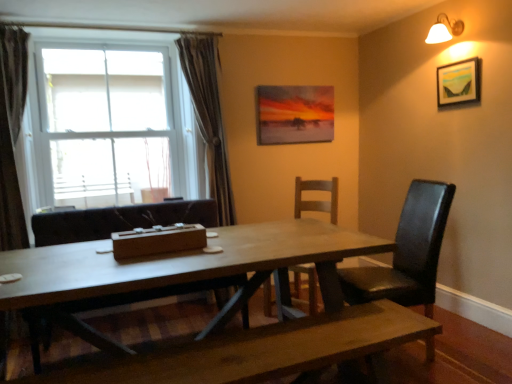
Question: Can you confirm if white glass window at upper left is smaller than matte canvas painting at upper center, acting as the 2th picture frame starting from the right?

Choices:
 (A) no
 (B) yes

Answer: (A)

Question: Considering the relative sizes of white glass window at upper left and matte canvas painting at upper center, the first picture frame positioned from the back, in the image provided, is white glass window at upper left bigger than matte canvas painting at upper center, the first picture frame positioned from the back,?

Choices:
 (A) yes
 (B) no

Answer: (A)

Question: From a real-world perspective, is white glass window at upper left on matte canvas painting at upper center, acting as the 2th picture frame starting from the right?

Choices:
 (A) no
 (B) yes

Answer: (A)

Question: Would you consider white glass window at upper left to be distant from matte canvas painting at upper center, placed as the second picture frame when sorted from front to back?

Choices:
 (A) yes
 (B) no

Answer: (A)

Question: Is white glass window at upper left touching matte canvas painting at upper center, placed as the second picture frame when sorted from front to back?

Choices:
 (A) no
 (B) yes

Answer: (A)

Question: Considering their positions, is brown fabric curtain at left, which is the second curtain in back-to-front order, located in front of or behind satin gray curtain at left, the 1th curtain in the back-to-front sequence?

Choices:
 (A) behind
 (B) front

Answer: (B)

Question: Visually, is brown fabric curtain at left, which ranks as the 1th curtain in left-to-right order, positioned to the left or to the right of satin gray curtain at left, the 1th curtain in the back-to-front sequence?

Choices:
 (A) left
 (B) right

Answer: (A)

Question: From their relative heights in the image, would you say brown fabric curtain at left, arranged as the second curtain when viewed from the right, is taller or shorter than satin gray curtain at left, which is the first curtain in right-to-left order?

Choices:
 (A) short
 (B) tall

Answer: (B)

Question: Is point (23, 56) closer or farther from the camera than point (193, 79)?

Choices:
 (A) closer
 (B) farther

Answer: (A)

Question: Considering the positions of wooden table at center and brown fabric curtain at left, which ranks as the 1th curtain in left-to-right order, in the image, is wooden table at center wider or thinner than brown fabric curtain at left, which ranks as the 1th curtain in left-to-right order,?

Choices:
 (A) thin
 (B) wide

Answer: (B)

Question: Is wooden table at center in front of or behind brown fabric curtain at left, which ranks as the 1th curtain in left-to-right order, in the image?

Choices:
 (A) behind
 (B) front

Answer: (B)

Question: From the image's perspective, is wooden table at center positioned above or below brown fabric curtain at left, arranged as the second curtain when viewed from the right?

Choices:
 (A) below
 (B) above

Answer: (A)

Question: Which is correct: wooden table at center is inside brown fabric curtain at left, which is the second curtain in back-to-front order, or outside of it?

Choices:
 (A) inside
 (B) outside

Answer: (B)

Question: From the image's perspective, is wooden table at center above or below matte canvas painting at upper center, the first picture frame positioned from the back?

Choices:
 (A) above
 (B) below

Answer: (B)

Question: Is wooden table at center wider or thinner than matte canvas painting at upper center, acting as the 2th picture frame starting from the right?

Choices:
 (A) thin
 (B) wide

Answer: (B)